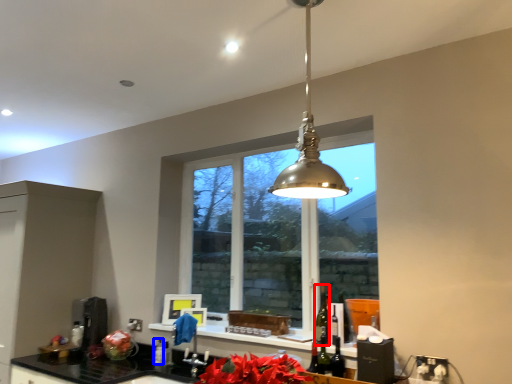
Question: Which of the following is the closest to the observer, alcohol (highlighted by a red box) or bottle (highlighted by a blue box)?

Choices:
 (A) alcohol
 (B) bottle

Answer: (A)